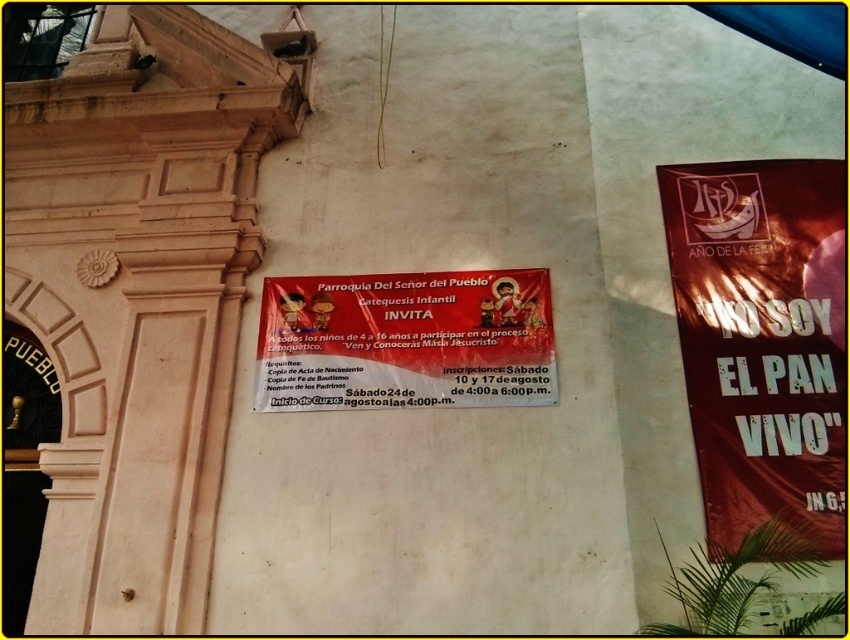
Question: Does metallic gold banner at right lie in front of matte paper poster at center?

Choices:
 (A) yes
 (B) no

Answer: (A)

Question: From the image, what is the correct spatial relationship of metallic gold banner at right in relation to matte paper poster at center?

Choices:
 (A) right
 (B) left

Answer: (A)

Question: Among these points, which one is nearest to the camera?

Choices:
 (A) (309, 348)
 (B) (837, 193)

Answer: (A)

Question: Among these points, which one is nearest to the camera?

Choices:
 (A) (398, 355)
 (B) (816, 216)

Answer: (A)

Question: Is metallic gold banner at right positioned behind matte paper poster at center?

Choices:
 (A) no
 (B) yes

Answer: (A)